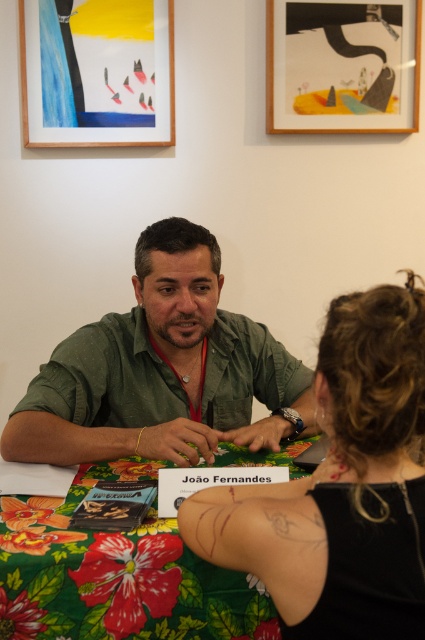
Can you confirm if black fabric hair at center is positioned to the left of green matte shirt at center?

In fact, black fabric hair at center is to the right of green matte shirt at center.

Who is shorter, black fabric hair at center or green matte shirt at center?

black fabric hair at center is shorter.

Locate an element on the screen. This screenshot has width=425, height=640. black fabric hair at center is located at coordinates (340, 486).

Who is positioned more to the left, green matte shirt at center or floral fabric tablecloth at center?

Positioned to the left is green matte shirt at center.

Find the location of a particular element. green matte shirt at center is located at coordinates (163, 371).

In the scene shown: How much distance is there between black fabric hair at center and floral fabric tablecloth at center?

black fabric hair at center is 10.78 inches from floral fabric tablecloth at center.

Between black fabric hair at center and floral fabric tablecloth at center, which one appears on the right side from the viewer's perspective?

black fabric hair at center

Is point (337, 298) positioned after point (217, 634)?

No, it is in front of (217, 634).

You are a GUI agent. You are given a task and a screenshot of the screen. Output one action in this format:
    pyautogui.click(x=<x>, y=<y>)
    Task: Click on the black fabric hair at center
    The image size is (425, 640).
    Given the screenshot: What is the action you would take?
    pyautogui.click(x=340, y=486)